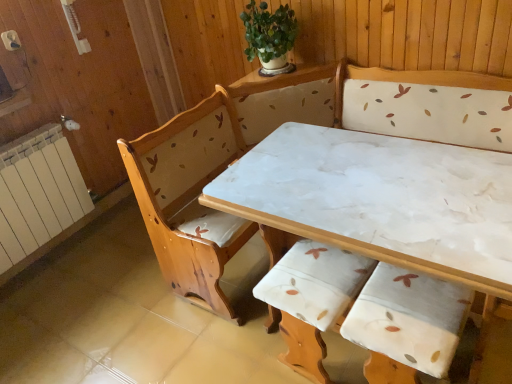
At what (x,y) coordinates should I click in order to perform the action: click on free spot above wooden armchair with floral upholstery at center (from a real-world perspective). Please return your answer as a coordinate pair (x, y). Looking at the image, I should click on (311, 282).